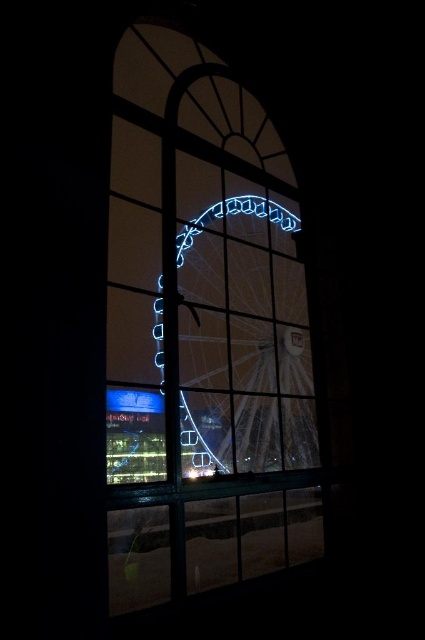
Between point (246, 166) and point (280, 307), which one is positioned behind?

The point (280, 307) is behind.

Find the location of a particular element. The width and height of the screenshot is (425, 640). clear glass window at center is located at coordinates (204, 330).